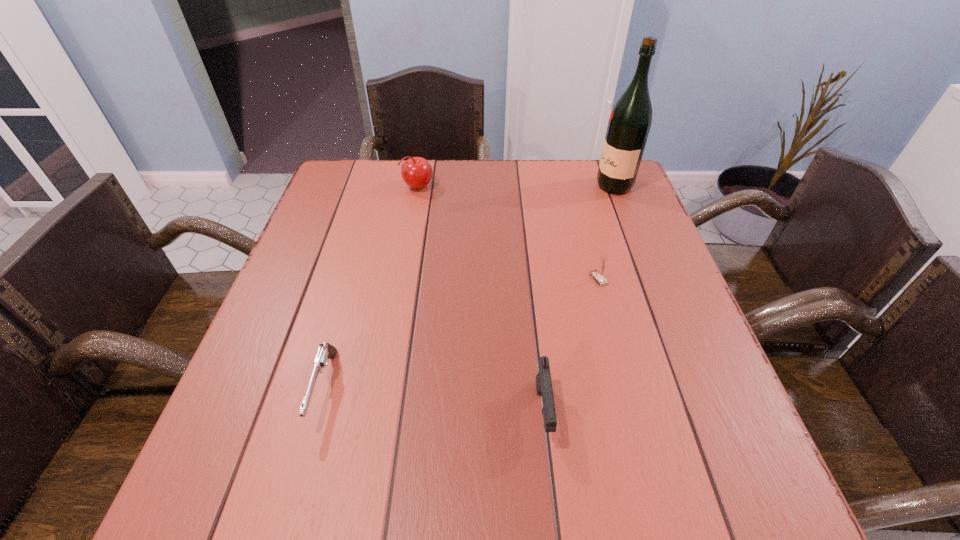
You are a GUI agent. You are given a task and a screenshot of the screen. Output one action in this format:
    pyautogui.click(x=<x>, y=<y>)
    Task: Click on the free spot that satisfies the following two spatial constraints: 1. on the front-facing side of the rightmost object; 2. at the barrel of the third object from left to right
    This screenshot has height=540, width=960.
    Given the screenshot: What is the action you would take?
    pyautogui.click(x=701, y=412)

This screenshot has height=540, width=960. What are the coordinates of `free point that satisfies the following two spatial constraints: 1. on the front-facing side of the liquor; 2. at the barrel of the right pistol` in the screenshot? It's located at (701, 412).

Locate an element on the screen. This screenshot has width=960, height=540. vacant space that satisfies the following two spatial constraints: 1. on the front-facing side of the tallest object; 2. on the front-facing side of the shortest object is located at coordinates click(692, 388).

The width and height of the screenshot is (960, 540). Identify the location of free space that satisfies the following two spatial constraints: 1. on the front-facing side of the tallest object; 2. on the front side of the second tallest object. (614, 187).

Find the location of `vacant region that satisfies the following two spatial constraints: 1. on the front-facing side of the rightmost object; 2. at the barrel of the taller pistol`. vacant region that satisfies the following two spatial constraints: 1. on the front-facing side of the rightmost object; 2. at the barrel of the taller pistol is located at coordinates (701, 412).

Where is `vacant space that satisfies the following two spatial constraints: 1. on the front-facing side of the liquor; 2. on the front-facing side of the shorter pistol`? Image resolution: width=960 pixels, height=540 pixels. vacant space that satisfies the following two spatial constraints: 1. on the front-facing side of the liquor; 2. on the front-facing side of the shorter pistol is located at coordinates (692, 388).